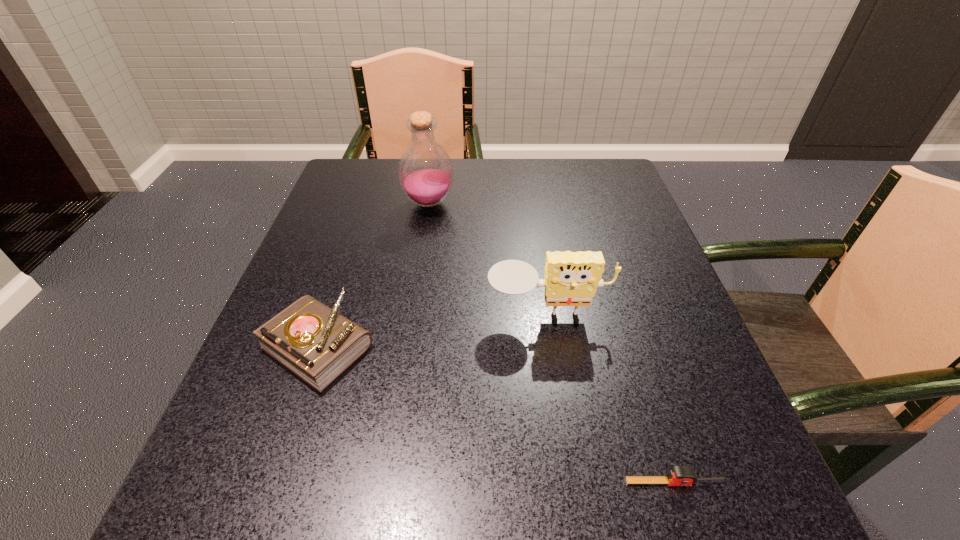
Image resolution: width=960 pixels, height=540 pixels. In the image, there is a desktop. In order to click on vacant region at the far left corner in this screenshot , I will do `click(393, 169)`.

This screenshot has width=960, height=540. In the image, there is a desktop. In order to click on vacant space at the far right corner in this screenshot , I will do `click(591, 159)`.

Locate an element on the screen. vacant space at the near right corner is located at coordinates (764, 526).

Locate an element on the screen. free space between the sponge and the tallest object is located at coordinates (489, 260).

The width and height of the screenshot is (960, 540). What are the coordinates of `free spot between the shortest object and the bottle` in the screenshot? It's located at (552, 343).

I want to click on vacant space that's between the second tallest object and the tape measure, so click(x=611, y=399).

This screenshot has height=540, width=960. I want to click on empty location between the diary and the bottle, so click(x=373, y=274).

Identify the location of free space between the shortest object and the farthest object. The height and width of the screenshot is (540, 960). (552, 343).

Where is `unoccupied position between the diary and the tallest object`? The width and height of the screenshot is (960, 540). unoccupied position between the diary and the tallest object is located at coordinates (373, 274).

Locate an element on the screen. The height and width of the screenshot is (540, 960). vacant space in between the shortest object and the second tallest object is located at coordinates (611, 399).